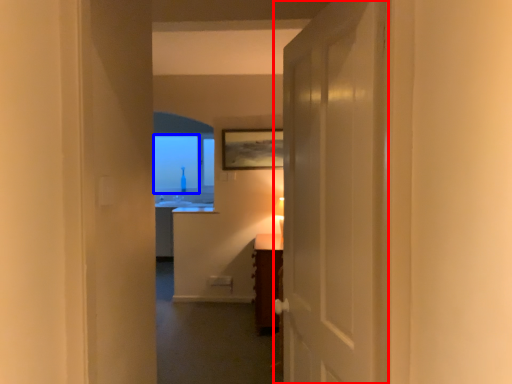
Question: Which point is closer to the camera, door (highlighted by a red box) or window screen (highlighted by a blue box)?

Choices:
 (A) door
 (B) window screen

Answer: (A)